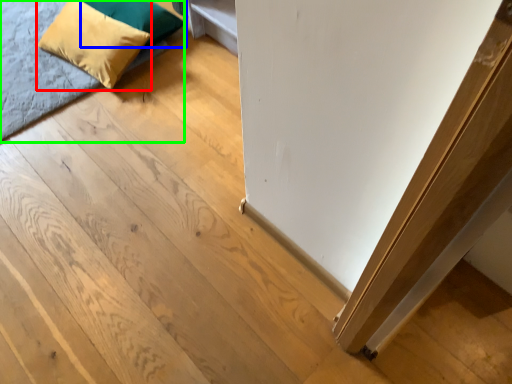
Question: Which object is positioned farthest from pillow (highlighted by a red box)? Select from pillow (highlighted by a blue box) and bed (highlighted by a green box).

Choices:
 (A) pillow
 (B) bed

Answer: (B)